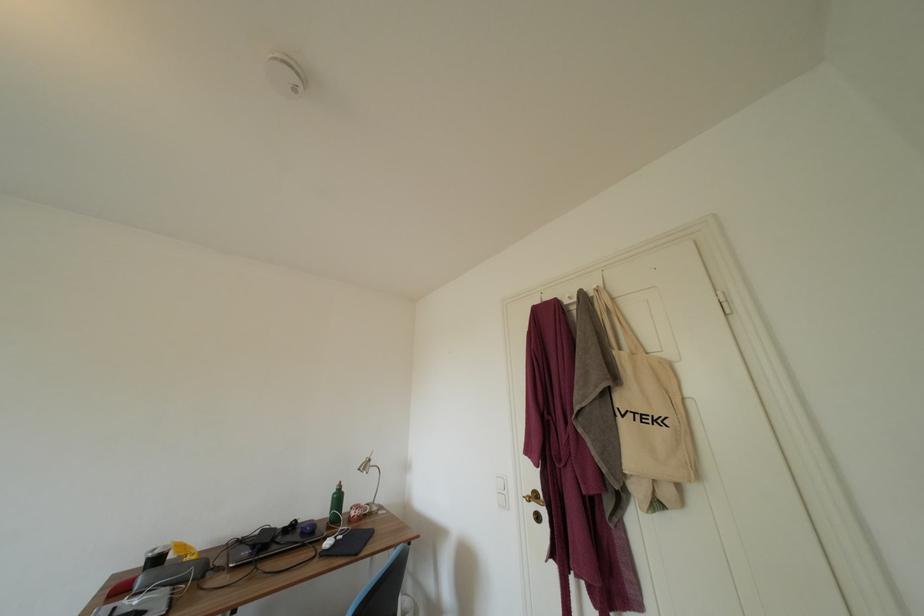
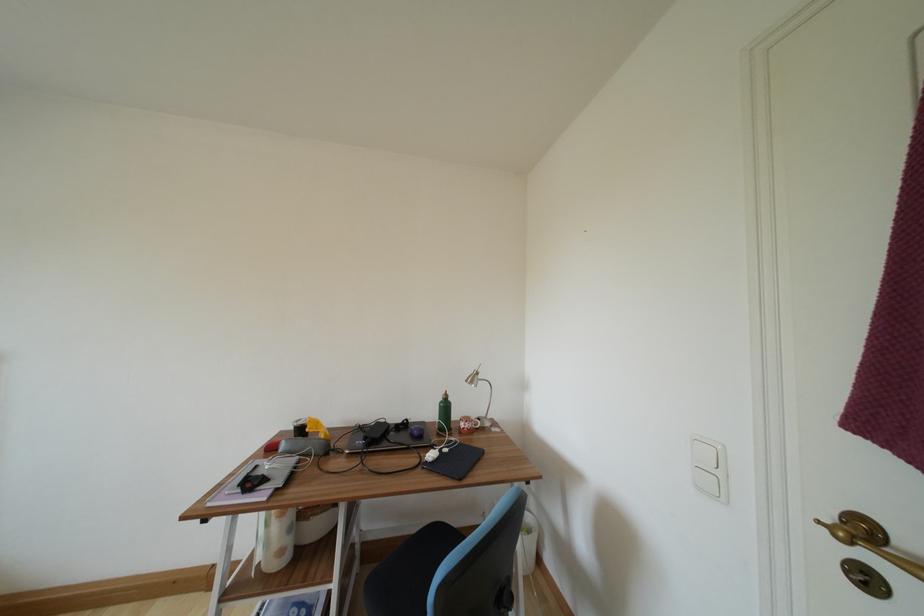
How did the camera likely rotate?

The camera's rotation is toward left-down.